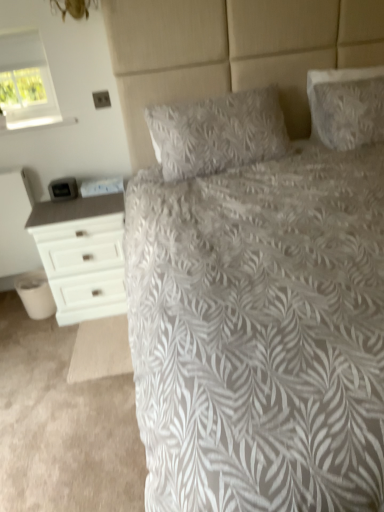
Question: Considering the relative sizes of white fabric window at upper left and white textured pillow at upper right, the second pillow positioned from the left, in the image provided, is white fabric window at upper left smaller than white textured pillow at upper right, the second pillow positioned from the left,?

Choices:
 (A) no
 (B) yes

Answer: (A)

Question: Can you confirm if white fabric window at upper left is positioned to the left of white textured pillow at upper right, the second pillow positioned from the left?

Choices:
 (A) no
 (B) yes

Answer: (B)

Question: From a real-world perspective, is white fabric window at upper left located higher than white textured pillow at upper right, which ranks as the first pillow in right-to-left order?

Choices:
 (A) no
 (B) yes

Answer: (B)

Question: Could you tell me if white fabric window at upper left is turned towards white textured pillow at upper right, which ranks as the first pillow in right-to-left order?

Choices:
 (A) yes
 (B) no

Answer: (B)

Question: Is white fabric window at upper left taller than white textured pillow at upper right, which ranks as the first pillow in right-to-left order?

Choices:
 (A) no
 (B) yes

Answer: (A)

Question: Visually, is white textured bed at center positioned to the left or to the right of white fabric window at upper left?

Choices:
 (A) left
 (B) right

Answer: (B)

Question: Is white textured bed at center bigger or smaller than white fabric window at upper left?

Choices:
 (A) big
 (B) small

Answer: (A)

Question: In the image, is white textured bed at center positioned in front of or behind white fabric window at upper left?

Choices:
 (A) front
 (B) behind

Answer: (A)

Question: From a real-world perspective, relative to white fabric window at upper left, is white textured bed at center vertically above or below?

Choices:
 (A) below
 (B) above

Answer: (A)

Question: Looking at the image, does white fabric window at upper left seem bigger or smaller compared to white painted wood nightstand at left?

Choices:
 (A) big
 (B) small

Answer: (A)

Question: Considering the positions of white fabric window at upper left and white painted wood nightstand at left in the image, is white fabric window at upper left taller or shorter than white painted wood nightstand at left?

Choices:
 (A) tall
 (B) short

Answer: (B)

Question: Considering the positions of point (18, 78) and point (11, 220), is point (18, 78) closer or farther from the camera than point (11, 220)?

Choices:
 (A) closer
 (B) farther

Answer: (B)

Question: Would you say white fabric window at upper left is to the left or to the right of white painted wood nightstand at left in the picture?

Choices:
 (A) right
 (B) left

Answer: (A)

Question: Based on their sizes in the image, would you say white painted wood nightstand at left is bigger or smaller than white textured bed at center?

Choices:
 (A) small
 (B) big

Answer: (A)

Question: From the image's perspective, is white painted wood nightstand at left above or below white textured bed at center?

Choices:
 (A) above
 (B) below

Answer: (B)